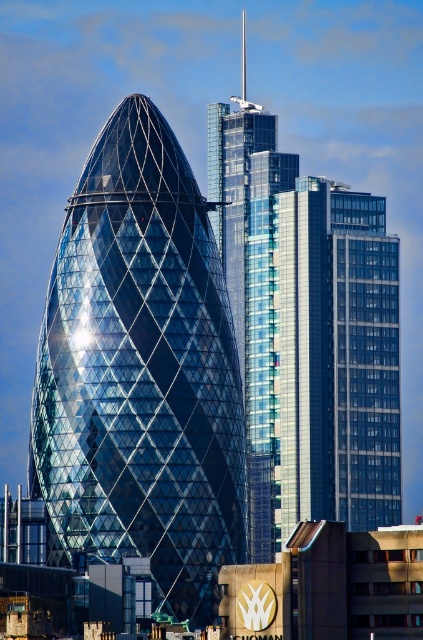
Is shiny glass tower at center further to the viewer compared to glassy steel building at center?

No, shiny glass tower at center is closer to the viewer.

Does shiny glass tower at center have a lesser height compared to glassy steel building at center?

In fact, shiny glass tower at center may be taller than glassy steel building at center.

Between point (139, 196) and point (286, 477), which one is positioned behind?

The point (286, 477) is more distant.

Identify the location of shiny glass tower at center. The image size is (423, 640). (140, 372).